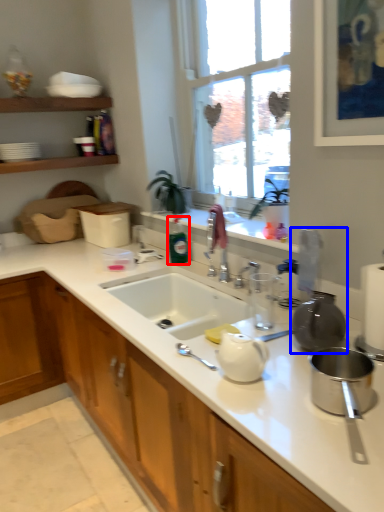
Question: Which object is further to the camera taking this photo, bottle (highlighted by a red box) or appliance (highlighted by a blue box)?

Choices:
 (A) bottle
 (B) appliance

Answer: (A)